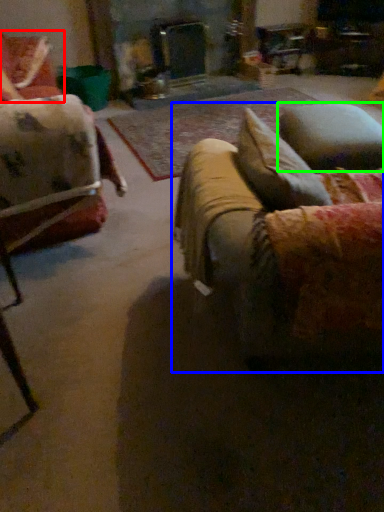
Question: Which is nearer to the chair (highlighted by a red box)? studio couch (highlighted by a blue box) or pillow (highlighted by a green box).

Choices:
 (A) studio couch
 (B) pillow

Answer: (B)